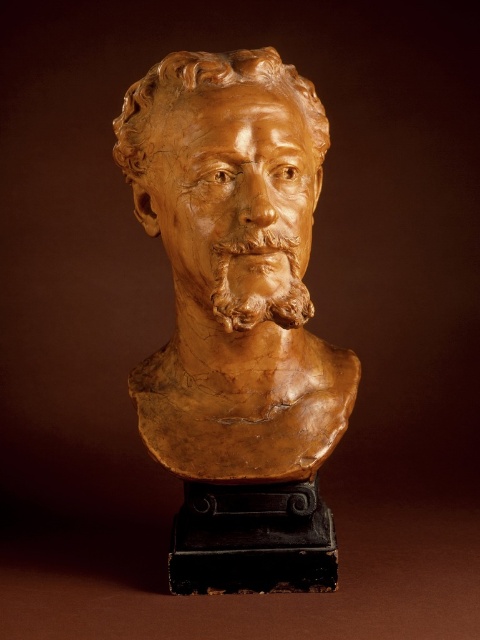
Question: Does matte clay bust at center lie behind brown clay bust at center?

Choices:
 (A) no
 (B) yes

Answer: (A)

Question: Does matte clay bust at center appear on the right side of brown clay bust at center?

Choices:
 (A) no
 (B) yes

Answer: (B)

Question: Is matte clay bust at center behind brown clay bust at center?

Choices:
 (A) yes
 (B) no

Answer: (B)

Question: Which point is closer to the camera taking this photo?

Choices:
 (A) (127, 170)
 (B) (181, 403)

Answer: (A)